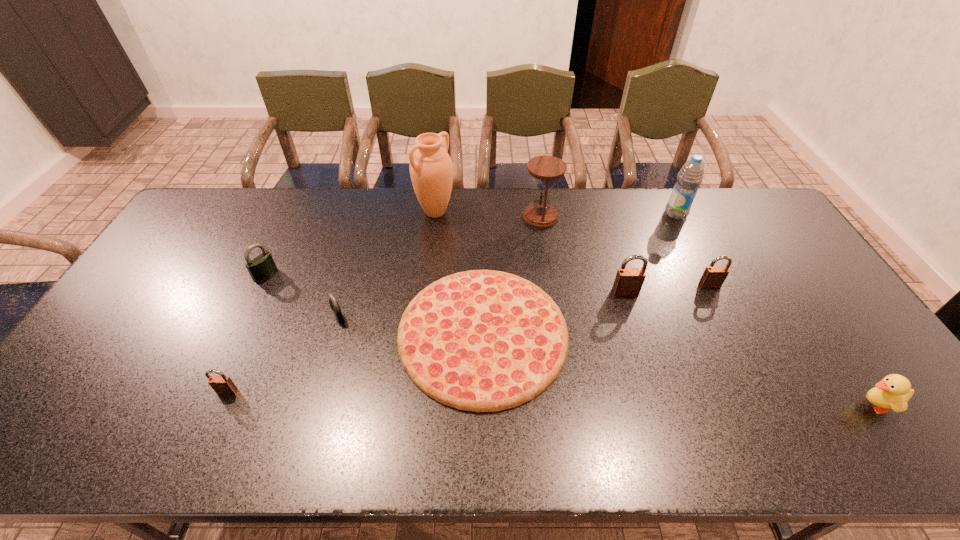
Locate an element on the screen. This screenshot has width=960, height=540. yellow duckling is located at coordinates (893, 392).

Identify the location of the smaller black padlock. (335, 307).

Image resolution: width=960 pixels, height=540 pixels. Identify the location of the third padlock from right to left. (335, 307).

This screenshot has width=960, height=540. In order to click on the nearest padlock in this screenshot , I will do `click(222, 384)`.

Identify the location of the smallest brown padlock. (222, 384).

Where is `red pizza`? This screenshot has height=540, width=960. red pizza is located at coordinates [481, 340].

You are a GUI agent. You are given a task and a screenshot of the screen. Output one action in this format:
    pyautogui.click(x=<x>, y=<y>)
    Task: Click on the pizza
    
    Given the screenshot: What is the action you would take?
    pyautogui.click(x=481, y=340)

At what (x,y) coordinates should I click in order to perform the action: click on vacant space situated on the right of the urn. Please return your answer as a coordinate pair (x, y). This screenshot has width=960, height=540. Looking at the image, I should click on (486, 212).

At what (x,y) coordinates should I click in order to perform the action: click on vacant space located on the left of the water bottle. Please return your answer as a coordinate pair (x, y). The image size is (960, 540). Looking at the image, I should click on (616, 214).

Locate an element on the screen. vacant space located 0.290m on the right of the hourglass is located at coordinates (640, 217).